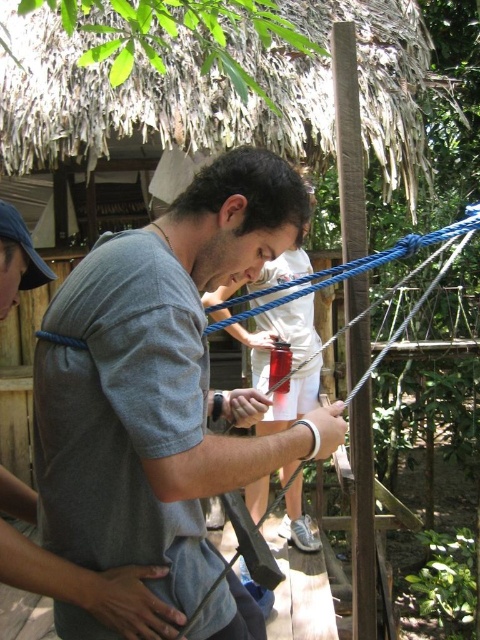
Question: Which point is closer to the camera taking this photo?

Choices:
 (A) (303, 340)
 (B) (85, 454)

Answer: (B)

Question: Is the position of gray matte shirt at center less distant than that of matte gray shirt at center?

Choices:
 (A) yes
 (B) no

Answer: (A)

Question: Which object appears closest to the camera in this image?

Choices:
 (A) matte gray shirt at center
 (B) gray matte shirt at center

Answer: (B)

Question: Can you confirm if gray matte shirt at center is positioned to the right of matte gray shirt at center?

Choices:
 (A) yes
 (B) no

Answer: (B)

Question: Does gray matte shirt at center appear under matte gray shirt at center?

Choices:
 (A) yes
 (B) no

Answer: (A)